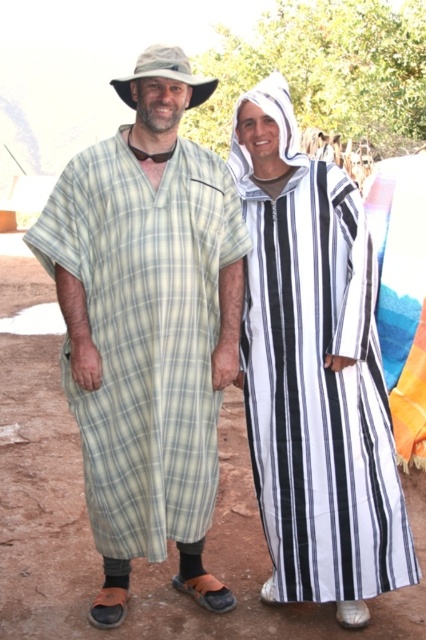
Question: Considering the real-world distances, which object is closest to the camouflage fabric cowboy hat at upper center?

Choices:
 (A) white striped robe at center
 (B) light green plaid robe at center

Answer: (B)

Question: Can you confirm if white striped robe at center is smaller than camouflage fabric cowboy hat at upper center?

Choices:
 (A) yes
 (B) no

Answer: (B)

Question: Can you confirm if white striped robe at center is positioned above camouflage fabric cowboy hat at upper center?

Choices:
 (A) yes
 (B) no

Answer: (B)

Question: Which of the following is the farthest from the observer?

Choices:
 (A) (140, 480)
 (B) (394, 481)

Answer: (B)

Question: Among these objects, which one is nearest to the camera?

Choices:
 (A) light green plaid robe at center
 (B) white striped robe at center
 (C) camouflage fabric cowboy hat at upper center

Answer: (A)

Question: Can you confirm if white striped robe at center is positioned to the right of camouflage fabric cowboy hat at upper center?

Choices:
 (A) no
 (B) yes

Answer: (B)